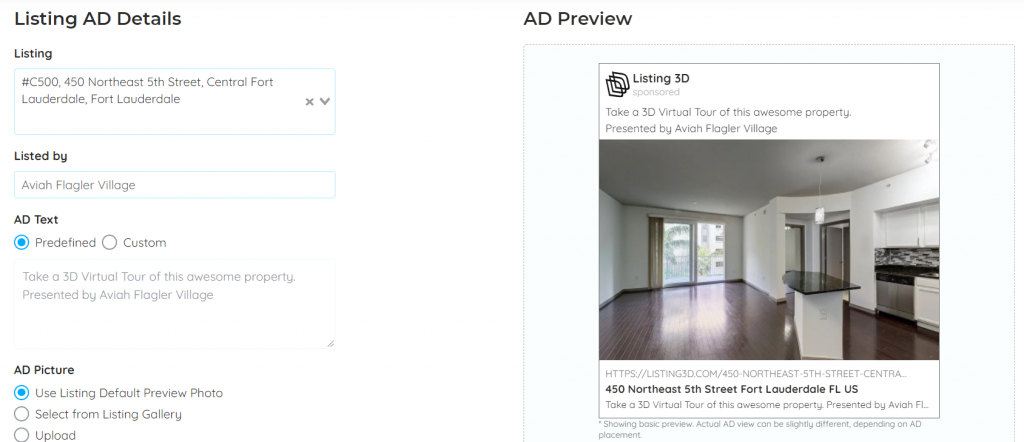
You are a GUI agent. You are given a task and a screenshot of the screen. Output one action in this format:
    pyautogui.click(x=<x>, y=<y>)
    Task: Click on the stove
    The height and width of the screenshot is (442, 1024).
    Given the screenshot: What is the action you would take?
    pyautogui.click(x=893, y=274)